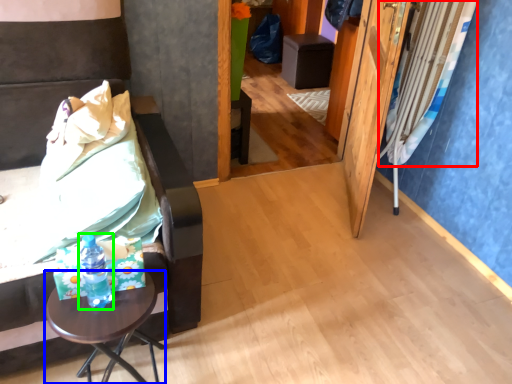
Question: Considering the real-world distances, which object is closest to curtain (highlighted by a red box)? table (highlighted by a blue box) or bottle (highlighted by a green box).

Choices:
 (A) table
 (B) bottle

Answer: (A)